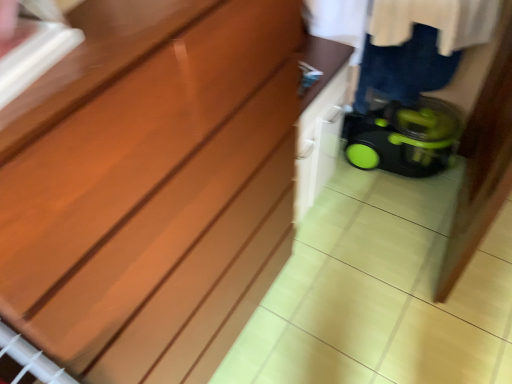
The image size is (512, 384). Describe the element at coordinates (403, 137) in the screenshot. I see `green plastic baby carriage at right` at that location.

Where is `green plastic baby carriage at right`? green plastic baby carriage at right is located at coordinates (403, 137).

This screenshot has width=512, height=384. I want to click on green plastic baby carriage at right, so click(403, 137).